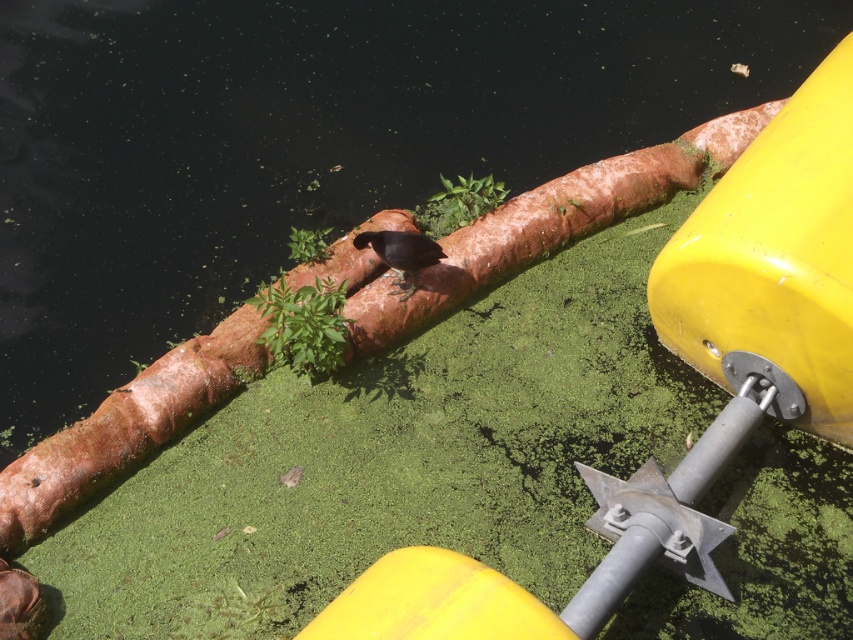
You are planning to kayak through the waterway and want to avoid the algae. The kayak is 36 inches wide. Can you safely pass between the green algae water at center and the green mossy algae at center without touching either?

The distance between the green algae water at center and the green mossy algae at center is 37.11 inches. Since the kayak is 36 inches wide, it can safely pass through the gap as there is enough space.

You are standing at the edge of the waterway and see two points marked in the scene. Which point is closer to you, point [468,180] or point [387,237]?

Point [387,237] is closer to you because it is less further to the camera than point [468,180].